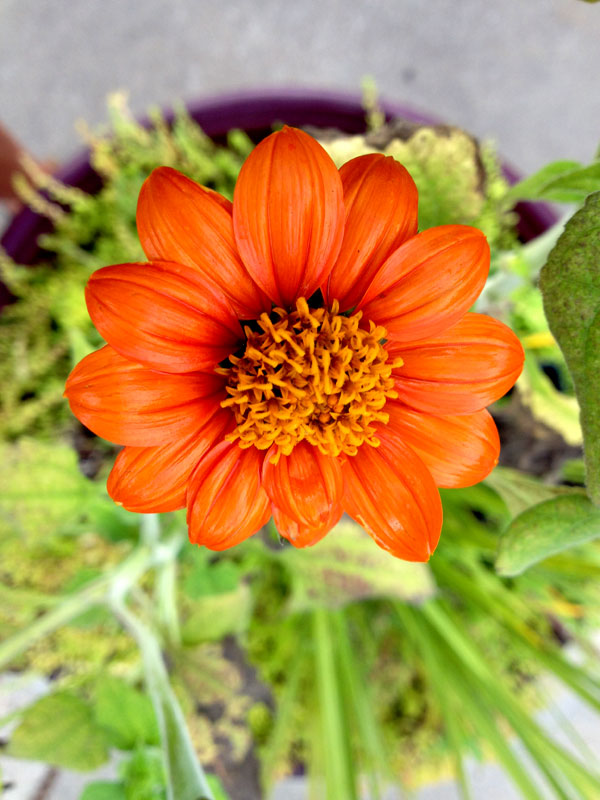
The image size is (600, 800). Find the location of `green plant`. green plant is located at coordinates (459, 701).